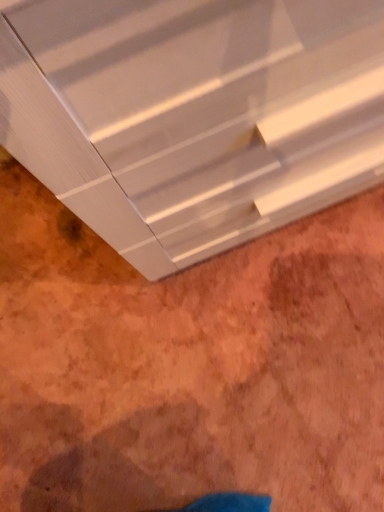
Where is `glossy white chest of drawers at upper center`? glossy white chest of drawers at upper center is located at coordinates (193, 115).

This screenshot has width=384, height=512. Describe the element at coordinates (193, 115) in the screenshot. I see `glossy white chest of drawers at upper center` at that location.

You are a GUI agent. You are given a task and a screenshot of the screen. Output one action in this format:
    pyautogui.click(x=<x>, y=<y>)
    Task: Click on the glossy white chest of drawers at upper center
    The height and width of the screenshot is (512, 384).
    Given the screenshot: What is the action you would take?
    pyautogui.click(x=193, y=115)